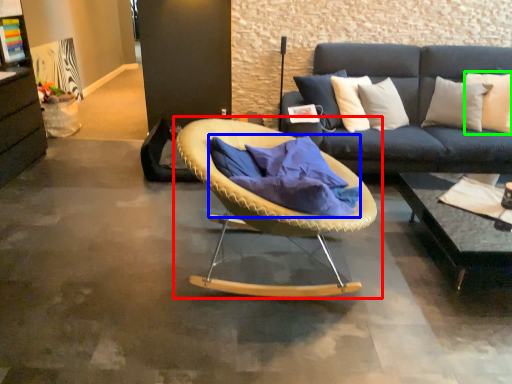
Question: Estimate the real-world distances between objects in this image. Which object is closer to chair (highlighted by a red box), blanket (highlighted by a blue box) or pillow (highlighted by a green box)?

Choices:
 (A) blanket
 (B) pillow

Answer: (A)